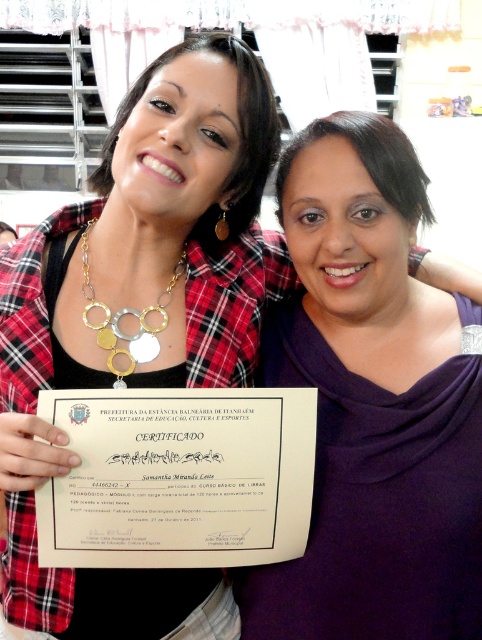
Question: Which of the following is the farthest from the observer?

Choices:
 (A) white paper certificate at center
 (B) gold metallic necklace at left
 (C) purple matte sweater at center

Answer: (B)

Question: Estimate the real-world distances between objects in this image. Which object is closer to the gold metallic necklace at left?

Choices:
 (A) purple matte sweater at center
 (B) white paper certificate at center

Answer: (B)

Question: Is purple matte sweater at center to the right of gold metallic necklace at left from the viewer's perspective?

Choices:
 (A) yes
 (B) no

Answer: (A)

Question: Does purple matte sweater at center have a greater width compared to gold metallic necklace at left?

Choices:
 (A) yes
 (B) no

Answer: (A)

Question: Among these objects, which one is nearest to the camera?

Choices:
 (A) gold metallic necklace at left
 (B) purple matte sweater at center

Answer: (B)

Question: Is purple matte sweater at center closer to camera compared to white paper certificate at center?

Choices:
 (A) yes
 (B) no

Answer: (B)